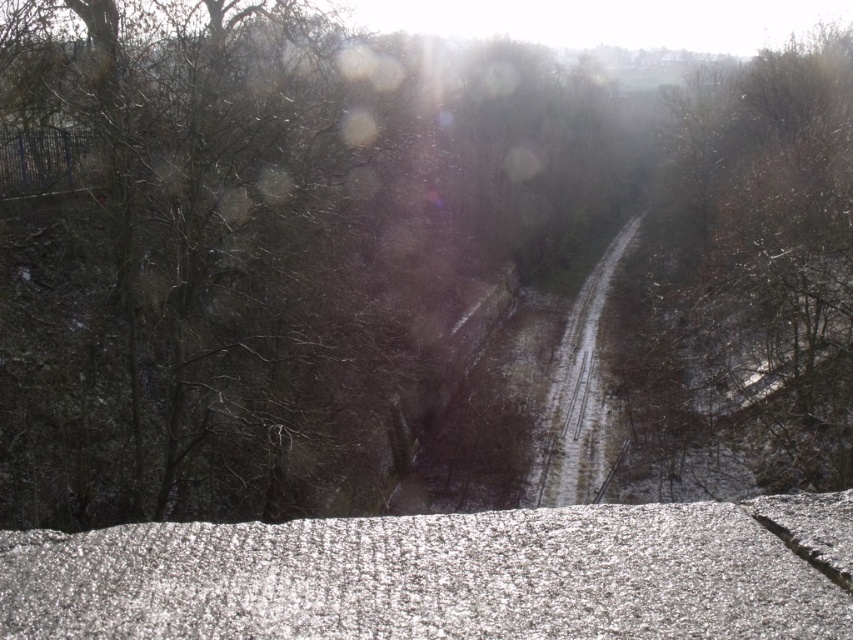
Question: Is white granular snow at bottom smaller than snowy gravel train track at center?

Choices:
 (A) yes
 (B) no

Answer: (A)

Question: Which object appears farthest from the camera in this image?

Choices:
 (A) white granular snow at bottom
 (B) snowy gravel train track at center

Answer: (B)

Question: Is brown leafless tree at right above snowy gravel train track at center?

Choices:
 (A) no
 (B) yes

Answer: (B)

Question: Which object is closer to the camera taking this photo?

Choices:
 (A) snowy gravel train track at center
 (B) brown leafless tree at right

Answer: (B)

Question: Estimate the real-world distances between objects in this image. Which object is farther from the white granular snow at bottom?

Choices:
 (A) brown leafless tree at right
 (B) snowy gravel train track at center

Answer: (A)

Question: In this image, where is white granular snow at bottom located relative to brown leafless tree at right?

Choices:
 (A) left
 (B) right

Answer: (A)